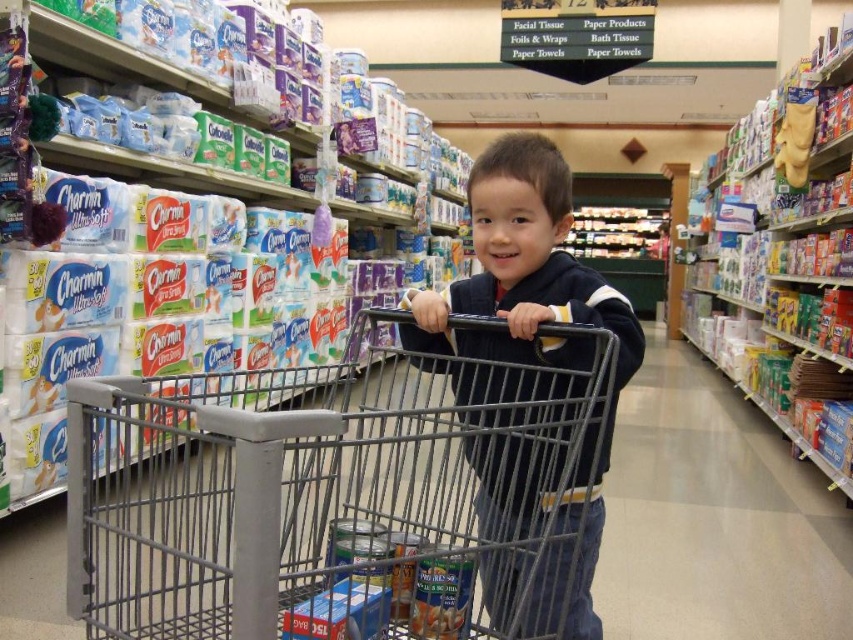
Question: Is metallic gray shopping cart at center further to camera compared to dark blue sweater at center?

Choices:
 (A) yes
 (B) no

Answer: (B)

Question: Is metallic gray shopping cart at center positioned in front of dark blue sweater at center?

Choices:
 (A) yes
 (B) no

Answer: (A)

Question: Does metallic gray shopping cart at center have a smaller size compared to dark blue sweater at center?

Choices:
 (A) no
 (B) yes

Answer: (A)